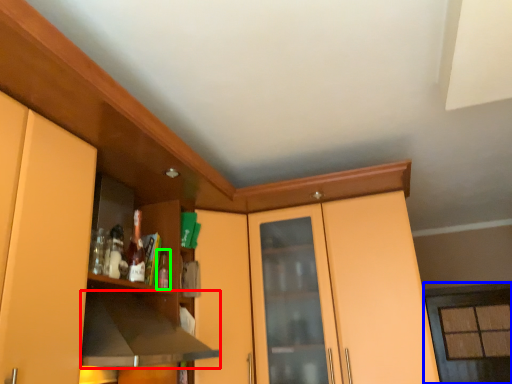
Question: Which object is positioned farthest from exhaust hood (highlighted by a red box)? Select from window (highlighted by a blue box) and bottle (highlighted by a green box).

Choices:
 (A) window
 (B) bottle

Answer: (A)